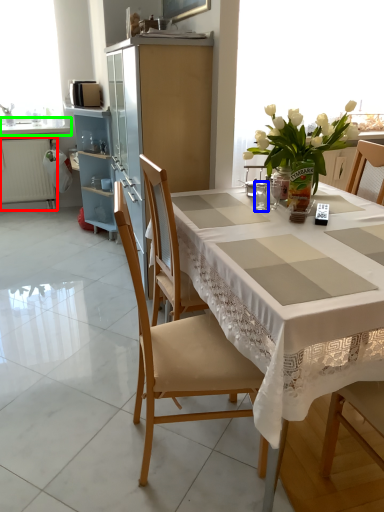
Question: Which object is positioned farthest from radiator (highlighted by a red box)? Select from tableware (highlighted by a blue box) and countertop (highlighted by a green box).

Choices:
 (A) tableware
 (B) countertop

Answer: (A)